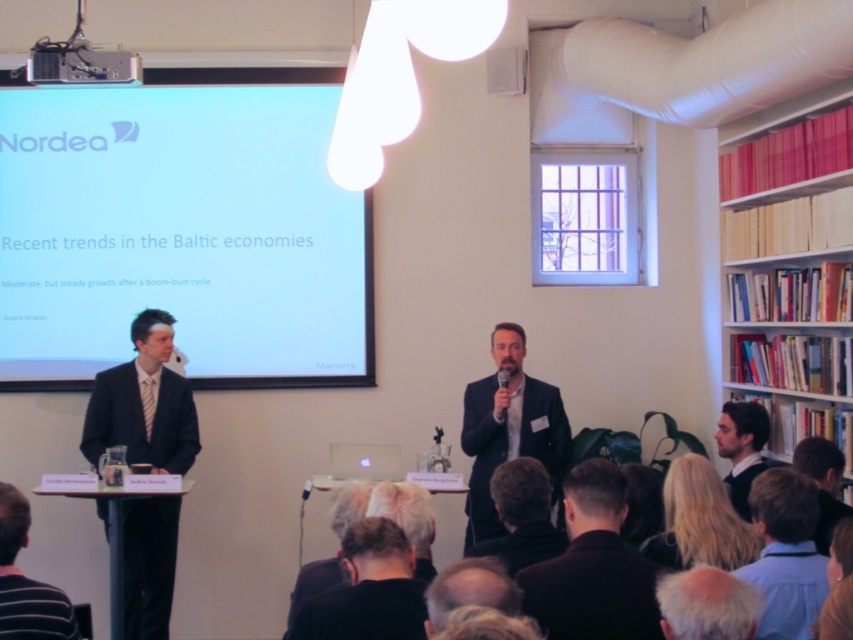
You are organizing a small presentation in the room. You need to place a 2.5 meter long table between the white matte projection screen at upper left and the hardcover books at right. Will there be enough space to place the table horizontally between them?

The distance between the white matte projection screen at upper left and the hardcover books at right is 3.07 meters. Since the table is 2.5 meters long, it will fit as the available space is larger than the table length.

You are attending a presentation and need to identify the speaker who is currently speaking. Based on their positions, which one is more to the left between the dark blue suit at center and the blue shirt at lower right?

The dark blue suit at center is positioned on the left side of the blue shirt at lower right, so the dark blue suit at center is more to the left.